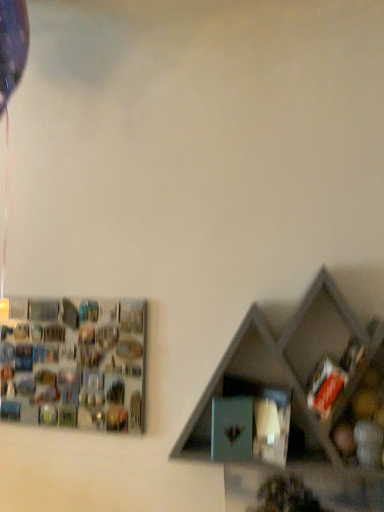
Image resolution: width=384 pixels, height=512 pixels. I want to click on matte gray shelf at lower right, which is the second shelf from left to right, so click(x=296, y=410).

Image resolution: width=384 pixels, height=512 pixels. Describe the element at coordinates (296, 410) in the screenshot. I see `matte gray shelf at lower right, which is the second shelf from left to right` at that location.

Locate an element on the screen. This screenshot has height=512, width=384. metallic silver frame at upper left, the 1th shelf from the back is located at coordinates (73, 362).

Describe the element at coordinates (73, 362) in the screenshot. I see `metallic silver frame at upper left, placed as the 2th shelf when sorted from front to back` at that location.

At what (x,y) coordinates should I click in order to perform the action: click on matte gray shelf at lower right, arranged as the 1th shelf when viewed from the right. Please return your answer as a coordinate pair (x, y). This screenshot has height=512, width=384. Looking at the image, I should click on (296, 410).

Which object is positioned more to the right, matte gray shelf at lower right, which appears as the second shelf when viewed from the back, or metallic silver frame at upper left, the 1th shelf from the back?

matte gray shelf at lower right, which appears as the second shelf when viewed from the back, is more to the right.

Is the position of matte gray shelf at lower right, which appears as the second shelf when viewed from the back, more distant than that of metallic silver frame at upper left, which is the 1th shelf from left to right?

No, the depth of matte gray shelf at lower right, which appears as the second shelf when viewed from the back, is less than that of metallic silver frame at upper left, which is the 1th shelf from left to right.

Between point (212, 432) and point (49, 335), which one is positioned in front?

The point (212, 432) is closer to the camera.

From the image's perspective, is matte gray shelf at lower right, the 1th shelf when ordered from front to back, above or below metallic silver frame at upper left, which is the second shelf from right to left?

Based on their image positions, matte gray shelf at lower right, the 1th shelf when ordered from front to back, is located above metallic silver frame at upper left, which is the second shelf from right to left.

From a real-world perspective, who is located lower, matte gray shelf at lower right, which is the second shelf from left to right, or metallic silver frame at upper left, which is the second shelf from right to left?

metallic silver frame at upper left, which is the second shelf from right to left, is physically lower.

Can you confirm if matte gray shelf at lower right, arranged as the 1th shelf when viewed from the right, is thinner than metallic silver frame at upper left, which is the second shelf from right to left?

In fact, matte gray shelf at lower right, arranged as the 1th shelf when viewed from the right, might be wider than metallic silver frame at upper left, which is the second shelf from right to left.

Considering the sizes of objects matte gray shelf at lower right, the 1th shelf when ordered from front to back, and metallic silver frame at upper left, the 1th shelf from the back, in the image provided, who is taller, matte gray shelf at lower right, the 1th shelf when ordered from front to back, or metallic silver frame at upper left, the 1th shelf from the back,?

Standing taller between the two is matte gray shelf at lower right, the 1th shelf when ordered from front to back.

Is matte gray shelf at lower right, arranged as the 1th shelf when viewed from the right, smaller than metallic silver frame at upper left, which is the second shelf from right to left?

Incorrect, matte gray shelf at lower right, arranged as the 1th shelf when viewed from the right, is not smaller in size than metallic silver frame at upper left, which is the second shelf from right to left.

Is matte gray shelf at lower right, the 1th shelf when ordered from front to back, spatially inside metallic silver frame at upper left, which is the second shelf from right to left, or outside of it?

matte gray shelf at lower right, the 1th shelf when ordered from front to back, exists outside the volume of metallic silver frame at upper left, which is the second shelf from right to left.

Is matte gray shelf at lower right, which is the second shelf from left to right, not close to metallic silver frame at upper left, which is the second shelf from right to left?

They are positioned close to each other.

Is matte gray shelf at lower right, the 1th shelf when ordered from front to back, facing away from metallic silver frame at upper left, placed as the 2th shelf when sorted from front to back?

matte gray shelf at lower right, the 1th shelf when ordered from front to back, does not have its back to metallic silver frame at upper left, placed as the 2th shelf when sorted from front to back.

I want to click on shelf beneath the matte gray shelf at lower right, which is the second shelf from left to right (from a real-world perspective), so click(x=73, y=362).

Does metallic silver frame at upper left, which is the second shelf from right to left, appear on the left side of matte gray shelf at lower right, which is the second shelf from left to right?

Yes.

Is metallic silver frame at upper left, placed as the 2th shelf when sorted from front to back, in front of or behind matte gray shelf at lower right, which appears as the second shelf when viewed from the back, in the image?

metallic silver frame at upper left, placed as the 2th shelf when sorted from front to back, is behind matte gray shelf at lower right, which appears as the second shelf when viewed from the back.

Considering the positions of points (48, 385) and (301, 338), is point (48, 385) closer to camera compared to point (301, 338)?

No, it is not.

From the image's perspective, who appears lower, metallic silver frame at upper left, placed as the 2th shelf when sorted from front to back, or matte gray shelf at lower right, which is the second shelf from left to right?

metallic silver frame at upper left, placed as the 2th shelf when sorted from front to back, from the image's perspective.

From a real-world perspective, is metallic silver frame at upper left, the 1th shelf from the back, above or below matte gray shelf at lower right, which is the second shelf from left to right?

In terms of real-world spatial position, metallic silver frame at upper left, the 1th shelf from the back, is below matte gray shelf at lower right, which is the second shelf from left to right.

Between metallic silver frame at upper left, placed as the 2th shelf when sorted from front to back, and matte gray shelf at lower right, arranged as the 1th shelf when viewed from the right, which one has smaller width?

metallic silver frame at upper left, placed as the 2th shelf when sorted from front to back, is thinner.

In terms of height, does metallic silver frame at upper left, the 1th shelf from the back, look taller or shorter compared to matte gray shelf at lower right, the 1th shelf when ordered from front to back?

metallic silver frame at upper left, the 1th shelf from the back, is shorter than matte gray shelf at lower right, the 1th shelf when ordered from front to back.

In the scene shown: Considering the sizes of objects metallic silver frame at upper left, which is the 1th shelf from left to right, and matte gray shelf at lower right, which appears as the second shelf when viewed from the back, in the image provided, who is bigger, metallic silver frame at upper left, which is the 1th shelf from left to right, or matte gray shelf at lower right, which appears as the second shelf when viewed from the back,?

matte gray shelf at lower right, which appears as the second shelf when viewed from the back.

Is metallic silver frame at upper left, placed as the 2th shelf when sorted from front to back, located outside matte gray shelf at lower right, which is the second shelf from left to right?

Yes, metallic silver frame at upper left, placed as the 2th shelf when sorted from front to back, is located beyond the bounds of matte gray shelf at lower right, which is the second shelf from left to right.

Is metallic silver frame at upper left, which is the second shelf from right to left, directly adjacent to matte gray shelf at lower right, which appears as the second shelf when viewed from the back?

No, metallic silver frame at upper left, which is the second shelf from right to left, is not with matte gray shelf at lower right, which appears as the second shelf when viewed from the back.

Could you tell me if metallic silver frame at upper left, which is the second shelf from right to left, is facing matte gray shelf at lower right, the 1th shelf when ordered from front to back?

No, metallic silver frame at upper left, which is the second shelf from right to left, does not turn towards matte gray shelf at lower right, the 1th shelf when ordered from front to back.

Looking at this image, how many degrees apart are the facing directions of metallic silver frame at upper left, which is the 1th shelf from left to right, and matte gray shelf at lower right, arranged as the 1th shelf when viewed from the right?

The angle between the facing direction of metallic silver frame at upper left, which is the 1th shelf from left to right, and the facing direction of matte gray shelf at lower right, arranged as the 1th shelf when viewed from the right, is 0.00218 degrees.

At what (x,y) coordinates should I click in order to perform the action: click on shelf lying on the right of metallic silver frame at upper left, which is the second shelf from right to left. Please return your answer as a coordinate pair (x, y). Looking at the image, I should click on (296, 410).

Where is `shelf below the matte gray shelf at lower right, arranged as the 1th shelf when viewed from the right (from the image's perspective)`? shelf below the matte gray shelf at lower right, arranged as the 1th shelf when viewed from the right (from the image's perspective) is located at coordinates (73, 362).

This screenshot has width=384, height=512. In order to click on shelf that appears above the metallic silver frame at upper left, which is the second shelf from right to left (from the image's perspective) in this screenshot , I will do `click(296, 410)`.